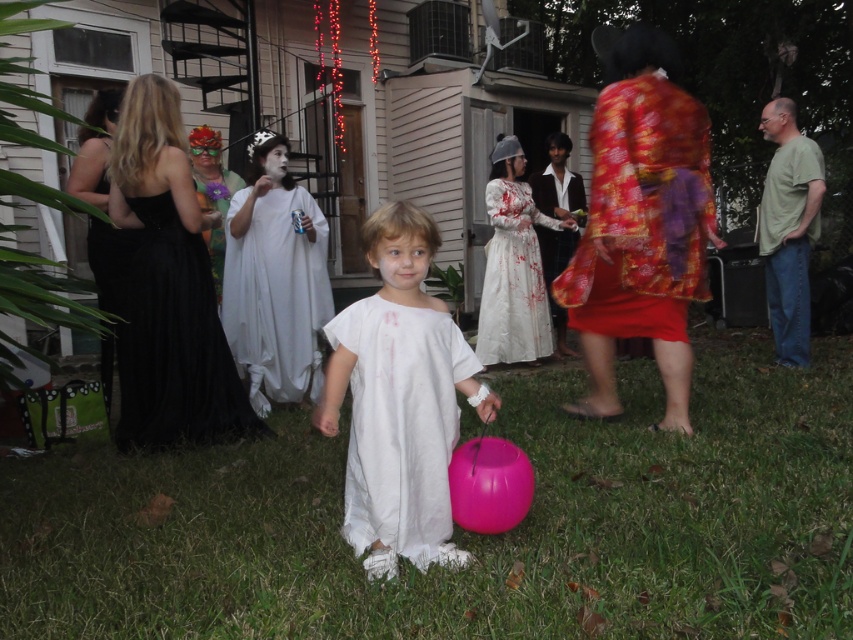
You are a photographer trying to capture a clear shot of both the white matte dress at center and the shiny red fabric robe at center. Since you want both to be visible, which one should you focus on first to ensure the background object remains in focus?

You should focus on the shiny red fabric robe at center first because the white matte dress at center is in front of it. By focusing on the background object, you can ensure the foreground object will still be in focus.